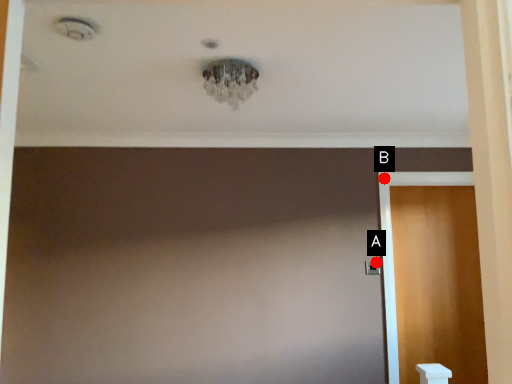
Question: Two points are circled on the image, labeled by A and B beside each circle. Which point appears closest to the camera in this image?

Choices:
 (A) A is closer
 (B) B is closer

Answer: (A)